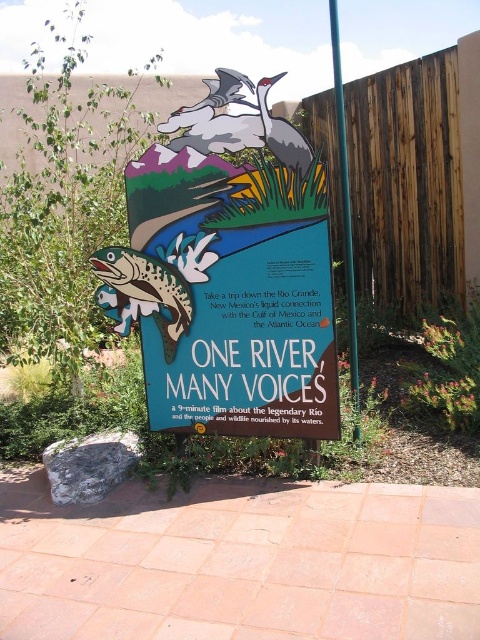
You are a tourist holding a camera and want to take a photo of the shiny metallic fish at center without the matte green signboard at center blocking the view. Is this possible given their sizes?

The matte green signboard at center is bigger than the shiny metallic fish at center, so it might block the fish if positioned directly in front. To capture the fish without obstruction, reposition the camera to angle around the signboard or move closer to the fish to frame it outside the signboard.

You are a visitor standing 2 meters away from the signboard. You want to place a 1.5 meter long banner between the matte green signboard at center and the green painted wood pole at center. Is there enough space between them to place the banner without bending it?

The matte green signboard at center and green painted wood pole at center are 1.03 meters apart from each other. Since the banner is 1.5 meters long, which is longer than the space between them, the banner cannot be placed straight between them without bending.

You are a park ranger checking the signboard. You need to ensure the shiny metallic fish at center and the green painted wood pole at center are correctly sized according to the design plan. According to the design, the fish should be narrower than the pole. Does the current setup meet the design requirement?

Yes, the shiny metallic fish at center is narrower than the green painted wood pole at center, so the current setup meets the design requirement.